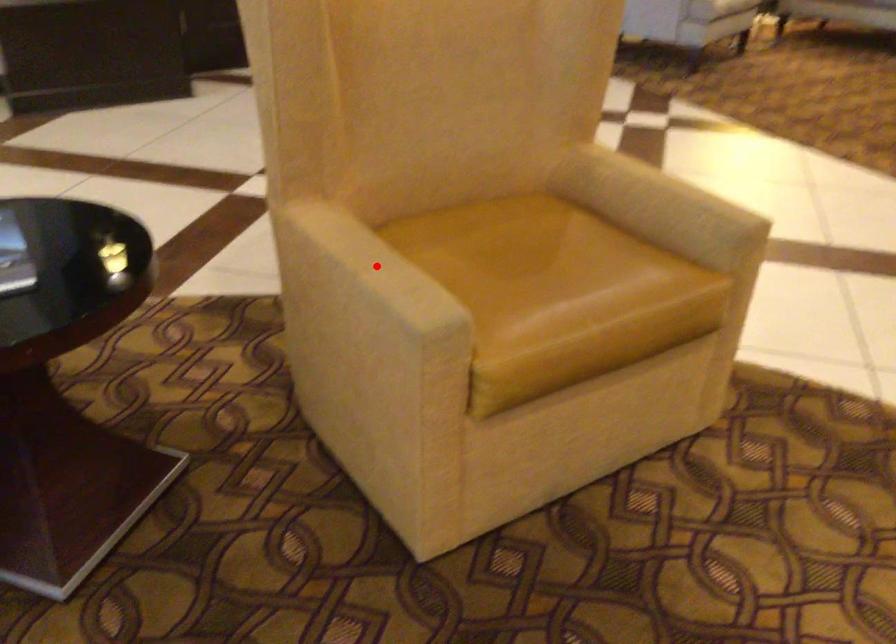
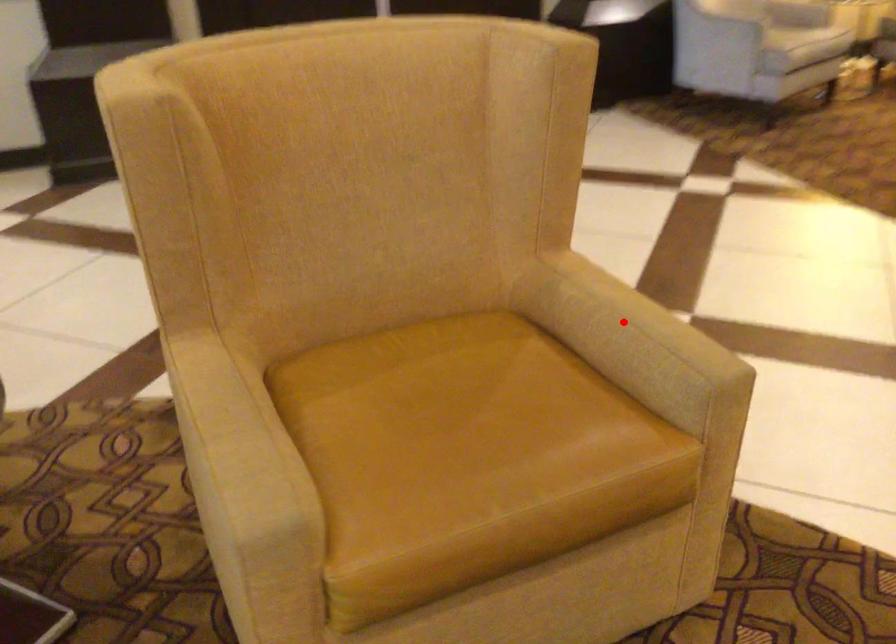
I am providing you with two images of the same scene from different viewpoints. A red point is marked on the first image and another point is marked on the second image. Do the highlighted points in image1 and image2 indicate the same real-world spot?

No